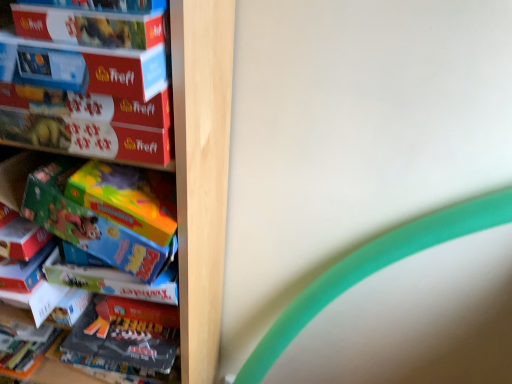
Question: From a real-world perspective, is wooden puzzle boxes at left above or below green matte toy at left?

Choices:
 (A) above
 (B) below

Answer: (B)

Question: Considering the positions of point (208, 294) and point (72, 216), is point (208, 294) closer or farther from the camera than point (72, 216)?

Choices:
 (A) farther
 (B) closer

Answer: (A)

Question: Which of these objects is positioned closest to the matte cardboard box at upper left, acting as the second paperback book starting from the bottom?

Choices:
 (A) wooden puzzle boxes at left
 (B) matte cardboard puzzle box at left
 (C) matte red puzzle box at upper left, which is the second paperback book from top to bottom
 (D) green matte toy at left

Answer: (C)

Question: Estimate the real-world distances between objects in this image. Which object is farther from the matte cardboard puzzle box at left?

Choices:
 (A) matte cardboard box at upper left, acting as the second paperback book starting from the bottom
 (B) matte red puzzle box at upper left, positioned as the first paperback book in bottom-to-top order
 (C) wooden puzzle boxes at left
 (D) green matte toy at left

Answer: (C)